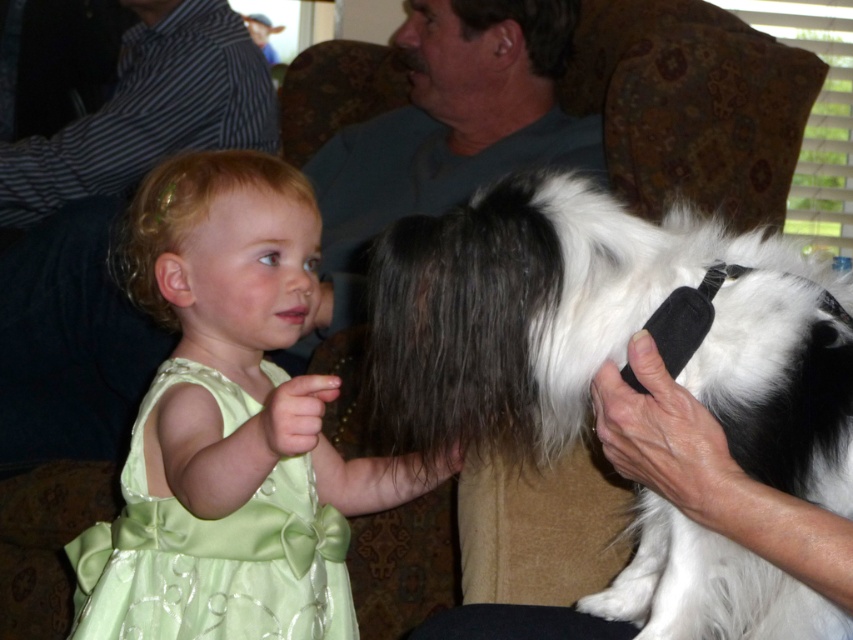
Can you confirm if black and white fur at center is taller than green satin dress at center?

In fact, black and white fur at center may be shorter than green satin dress at center.

Between black and white fur at center and green satin dress at center, which one is positioned higher?

black and white fur at center

Does point (599, 356) lie in front of point (274, 396)?

No, it is behind (274, 396).

Image resolution: width=853 pixels, height=640 pixels. Identify the location of black and white fur at center. (605, 328).

Does point (196, 490) come farther from viewer compared to point (76, 556)?

No, (196, 490) is closer to viewer.

In the scene shown: Is green satin dress at center to the right of satin green dress at center from the viewer's perspective?

Yes, green satin dress at center is to the right of satin green dress at center.

Does point (318, 467) lie in front of point (247, 589)?

No, (318, 467) is further to viewer.

This screenshot has width=853, height=640. I want to click on green satin dress at center, so click(x=230, y=426).

From the picture: Between black and white fur at center and satin green dress at center, which one appears on the left side from the viewer's perspective?

satin green dress at center

Describe the element at coordinates (605, 328) in the screenshot. I see `black and white fur at center` at that location.

Which is behind, point (486, 300) or point (93, 600)?

Positioned behind is point (93, 600).

I want to click on black and white fur at center, so click(605, 328).